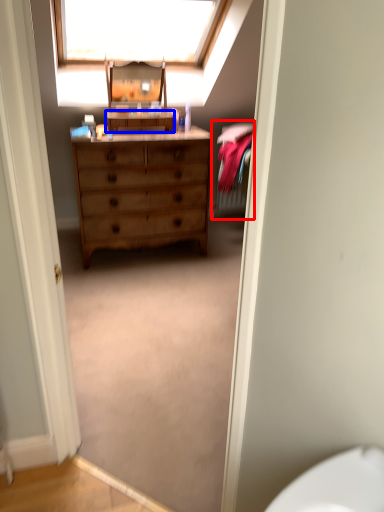
Question: Which of the following is the farthest to the observer, bed (highlighted by a red box) or cabinetry (highlighted by a blue box)?

Choices:
 (A) bed
 (B) cabinetry

Answer: (A)